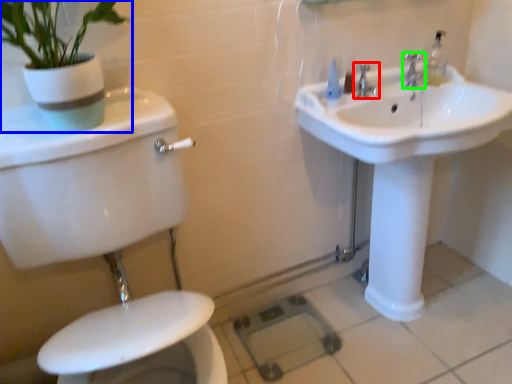
Question: Which is nearer to the tap (highlighted by a red box)? houseplant (highlighted by a blue box) or tap (highlighted by a green box).

Choices:
 (A) houseplant
 (B) tap

Answer: (B)